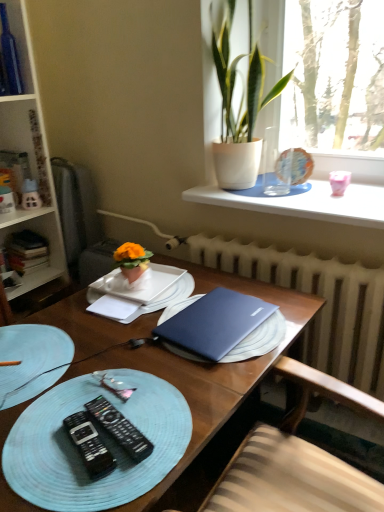
The image size is (384, 512). I want to click on free space in front of white matte notebook at center, so click(106, 344).